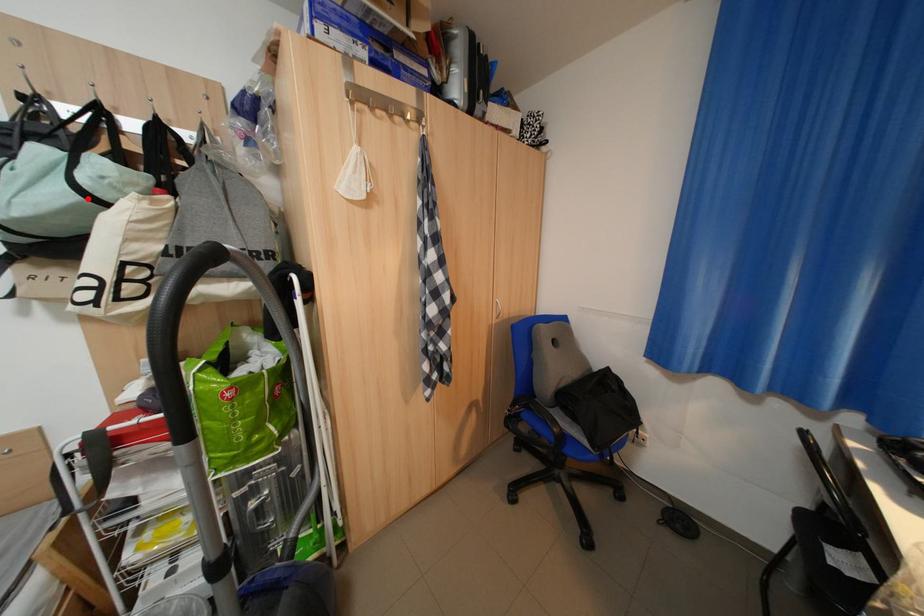
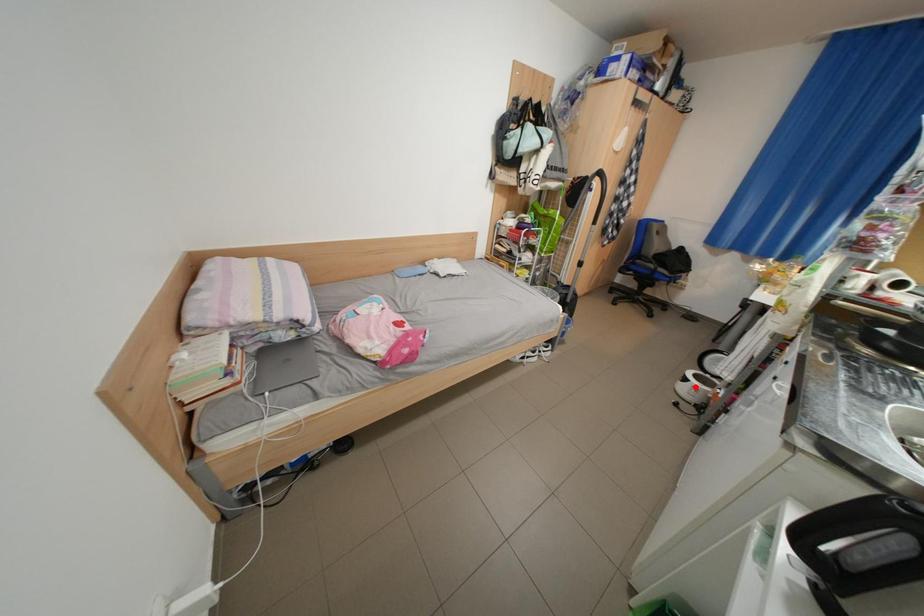
I am providing you with two images of the same scene from different viewpoints. A red point is marked on the first image and another point is marked on the second image. Do the highlighted points in image1 and image2 indicate the same real-world spot?

No